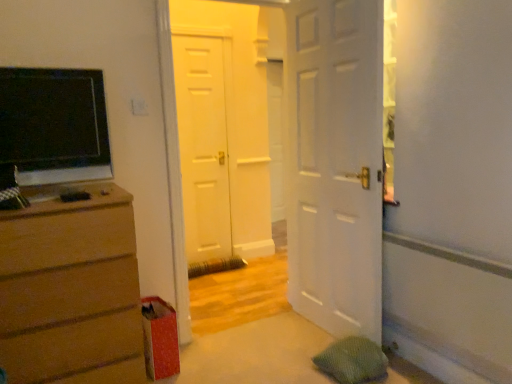
The height and width of the screenshot is (384, 512). Identify the location of free space between white matte door at center, the 1th door in the back-to-front sequence, and white matte door at center, the 2th door positioned from the back. (233, 300).